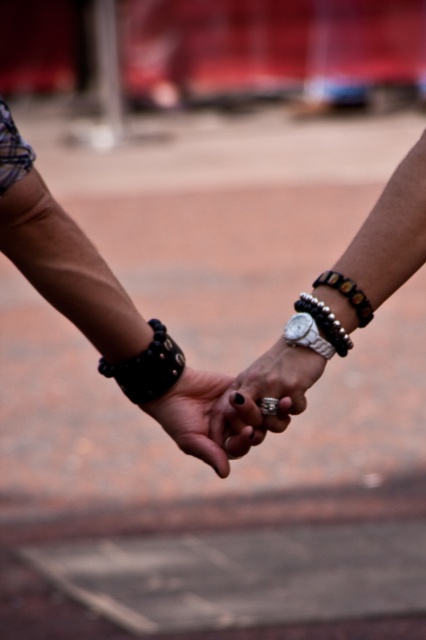
From the picture: Can you confirm if silver metallic watch at center is smaller than black beaded bracelet at center?

Yes.

You are a GUI agent. You are given a task and a screenshot of the screen. Output one action in this format:
    pyautogui.click(x=<x>, y=<y>)
    Task: Click on the silver metallic watch at center
    The image size is (426, 640).
    Given the screenshot: What is the action you would take?
    pyautogui.click(x=307, y=333)

Does black leather bracelet at center have a lesser height compared to leather studded bracelet at center?

No.

Locate an element on the screen. black leather bracelet at center is located at coordinates (147, 368).

Does black leather ring at center have a smaller size compared to leather studded bracelet at center?

No.

Does black leather ring at center have a lesser width compared to leather studded bracelet at center?

No, black leather ring at center is not thinner than leather studded bracelet at center.

Identify the location of black leather ring at center. (213, 417).

What are the coordinates of `black leather ring at center` in the screenshot? It's located at (213, 417).